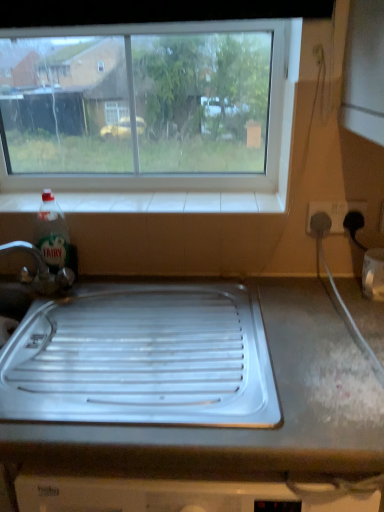
Question: Can you confirm if white tile at upper center is thinner than green translucent liquid at bottle left?

Choices:
 (A) no
 (B) yes

Answer: (A)

Question: Is white tile at upper center far from green translucent liquid at bottle left?

Choices:
 (A) yes
 (B) no

Answer: (B)

Question: From the image's perspective, would you say white tile at upper center is positioned over green translucent liquid at bottle left?

Choices:
 (A) yes
 (B) no

Answer: (A)

Question: Considering the relative sizes of white tile at upper center and green translucent liquid at bottle left in the image provided, is white tile at upper center bigger than green translucent liquid at bottle left?

Choices:
 (A) yes
 (B) no

Answer: (A)

Question: Does white tile at upper center have a lesser height compared to green translucent liquid at bottle left?

Choices:
 (A) yes
 (B) no

Answer: (A)

Question: Does white tile at upper center come behind green translucent liquid at bottle left?

Choices:
 (A) yes
 (B) no

Answer: (A)

Question: Is transparent glass window at upper center behind white tile at upper center?

Choices:
 (A) no
 (B) yes

Answer: (A)

Question: From the image's perspective, is transparent glass window at upper center on top of white tile at upper center?

Choices:
 (A) yes
 (B) no

Answer: (A)

Question: Does transparent glass window at upper center have a lesser height compared to white tile at upper center?

Choices:
 (A) yes
 (B) no

Answer: (B)

Question: Does transparent glass window at upper center have a greater width compared to white tile at upper center?

Choices:
 (A) no
 (B) yes

Answer: (A)

Question: From a real-world perspective, is transparent glass window at upper center beneath white tile at upper center?

Choices:
 (A) yes
 (B) no

Answer: (B)

Question: Would you say transparent glass window at upper center is outside white tile at upper center?

Choices:
 (A) yes
 (B) no

Answer: (A)

Question: Does white plastic socket at right have a lesser width compared to transparent glass window at upper center?

Choices:
 (A) yes
 (B) no

Answer: (A)